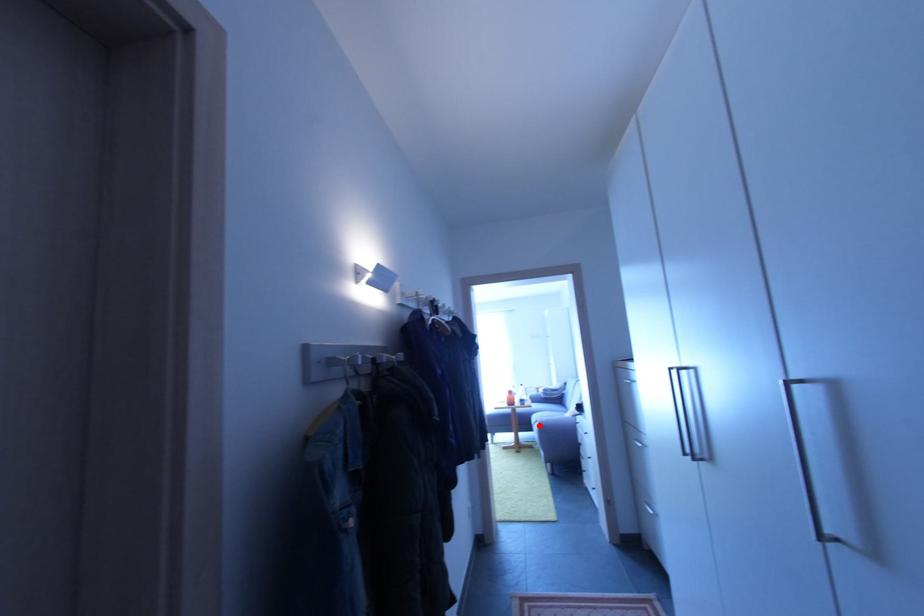
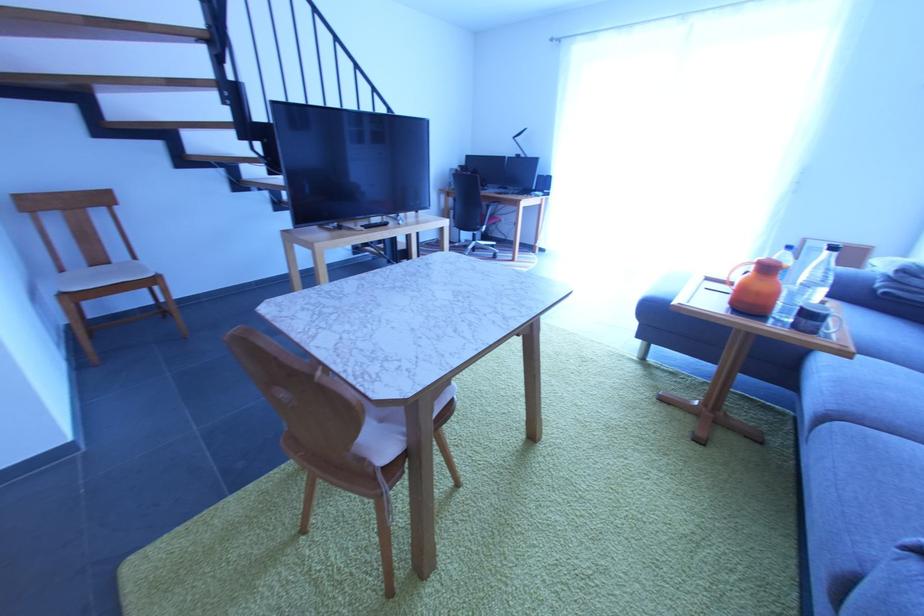
Question: I am providing you with two images of the same scene from different viewpoints. A red point is shown in image1. For the corresponding object point in image2, is it positioned nearer or farther from the camera?

Choices:
 (A) Nearer
 (B) Farther

Answer: (A)